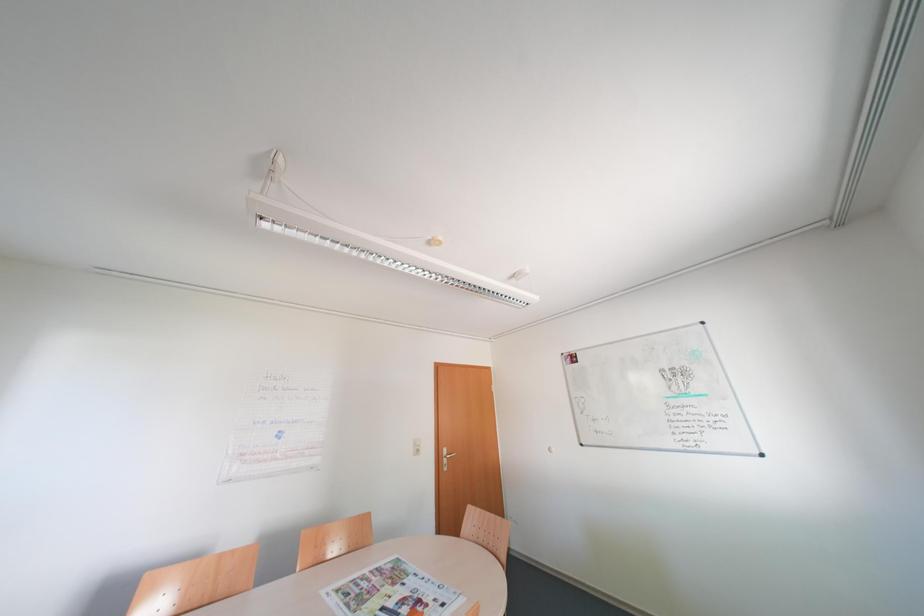
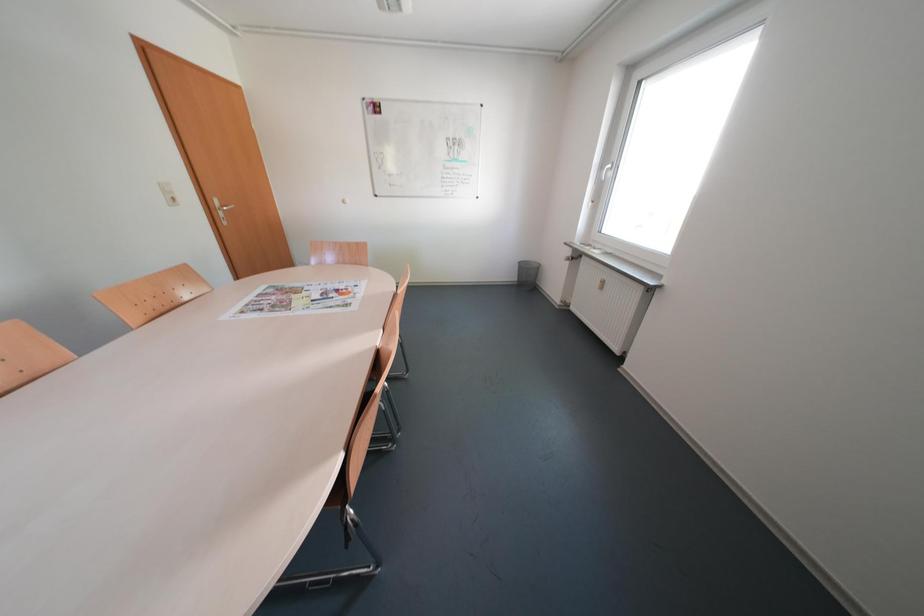
How did the camera likely rotate?

The rotation direction of the camera is right-down.